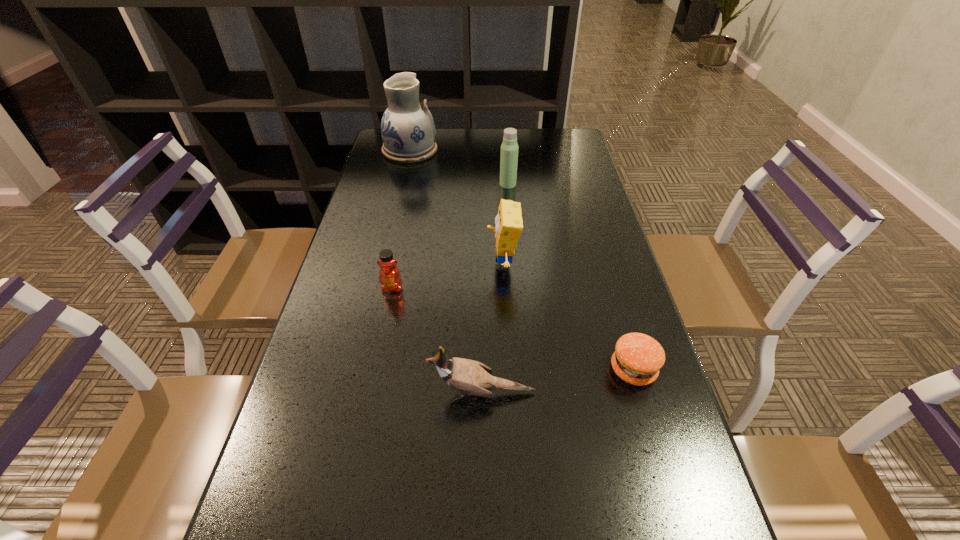
Where is `object that ranks as the fifth closest to the rightmost object`? object that ranks as the fifth closest to the rightmost object is located at coordinates (509, 149).

Select which object appears as the third closest to the bird. Please provide its 2D coordinates. Your answer should be formatted as a tuple, i.e. [(x, y)], where the tuple contains the x and y coordinates of a point satisfying the conditions above.

[(509, 224)]

Identify the location of vacant region that satisfies the following two spatial constraints: 1. on the front side of the sixth nearest object; 2. at the face of the bird. Image resolution: width=960 pixels, height=540 pixels. (525, 393).